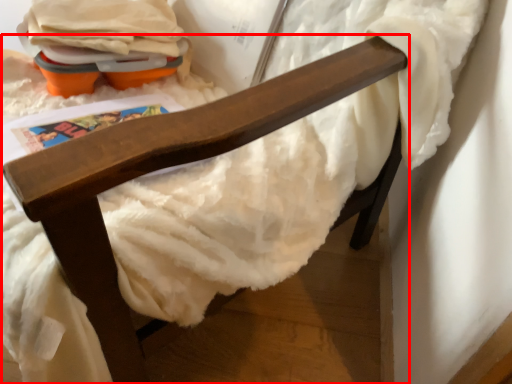
Question: Observing the image, what is the correct spatial positioning of furniture (annotated by the red box) in reference to toy?

Choices:
 (A) left
 (B) right

Answer: (B)